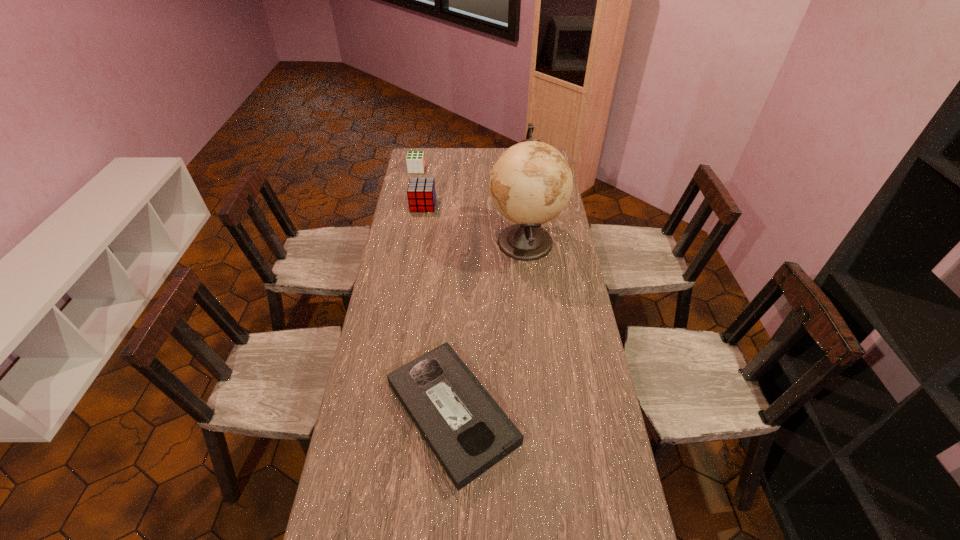
The width and height of the screenshot is (960, 540). I want to click on the tallest object, so click(531, 183).

At what (x,y) coordinates should I click in order to perform the action: click on globe. Please return your answer as a coordinate pair (x, y). Looking at the image, I should click on (531, 183).

You are a GUI agent. You are given a task and a screenshot of the screen. Output one action in this format:
    pyautogui.click(x=<x>, y=<y>)
    Task: Click on the second tallest object
    This screenshot has width=960, height=540.
    Given the screenshot: What is the action you would take?
    pyautogui.click(x=421, y=194)

I want to click on the taller cube, so [421, 194].

At what (x,y) coordinates should I click in order to perform the action: click on the farther cube. Please return your answer as a coordinate pair (x, y). Looking at the image, I should click on (415, 160).

Image resolution: width=960 pixels, height=540 pixels. In order to click on the second shortest object in this screenshot , I will do `click(415, 160)`.

You are a GUI agent. You are given a task and a screenshot of the screen. Output one action in this format:
    pyautogui.click(x=<x>, y=<y>)
    Task: Click on the videotape
    The height and width of the screenshot is (540, 960).
    Given the screenshot: What is the action you would take?
    pyautogui.click(x=468, y=432)

The height and width of the screenshot is (540, 960). Find the location of `the shortest object`. the shortest object is located at coordinates (468, 432).

Where is `free spot located on the front-facing side of the second nearest object`? This screenshot has width=960, height=540. free spot located on the front-facing side of the second nearest object is located at coordinates (417, 241).

Identify the location of free space located on the front-facing side of the second nearest object. (474, 241).